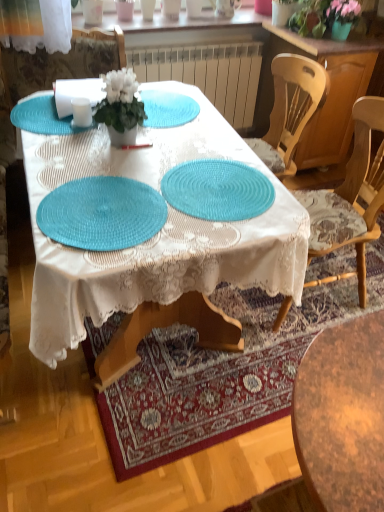
The image size is (384, 512). Find the location of `free point behind white matte pot at center`. free point behind white matte pot at center is located at coordinates (158, 116).